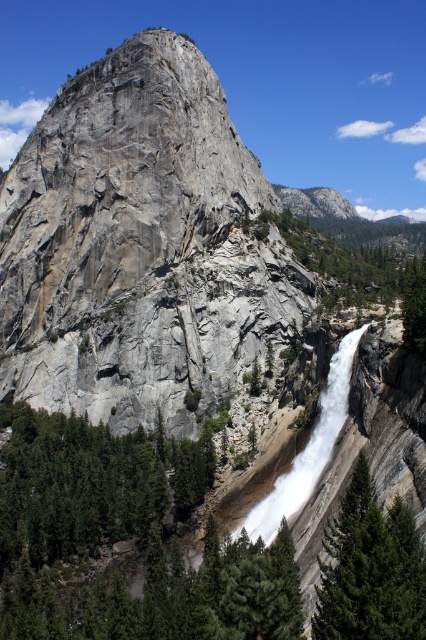
Question: Which object is the farthest from the white frothy water at center?

Choices:
 (A) green leafy tree at right
 (B) green textured tree at lower right

Answer: (B)

Question: Which of these objects is positioned closest to the green textured tree at lower right?

Choices:
 (A) green leafy tree at right
 (B) green matte tree at lower left

Answer: (A)

Question: Does green textured tree at lower right appear under white frothy water at center?

Choices:
 (A) no
 (B) yes

Answer: (B)

Question: Does green matte tree at lower left appear on the right side of green textured tree at lower right?

Choices:
 (A) no
 (B) yes

Answer: (A)

Question: Which point is closer to the camera?

Choices:
 (A) green leafy tree at right
 (B) green textured tree at lower right
 (C) white frothy water at center
 (D) green matte tree at lower left

Answer: (B)

Question: Is green matte tree at lower left positioned behind green leafy tree at right?

Choices:
 (A) yes
 (B) no

Answer: (A)